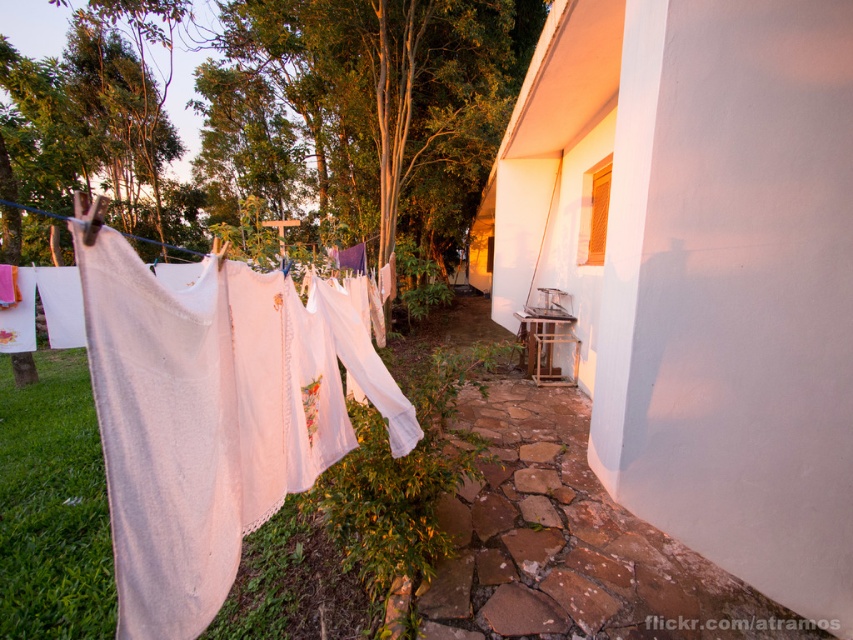
Does green leafy tree at upper left appear under white cotton laundry at left?

No, green leafy tree at upper left is not below white cotton laundry at left.

Can you confirm if green leafy tree at upper left is bigger than white cotton laundry at left?

Yes, green leafy tree at upper left is bigger than white cotton laundry at left.

In order to click on green leafy tree at upper left in this screenshot , I will do `click(282, 124)`.